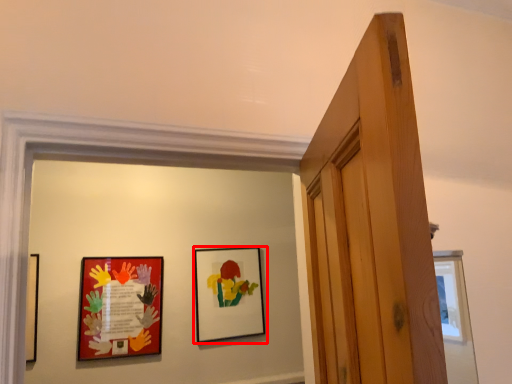
Question: From the image's perspective, where is picture frame (annotated by the red box) located in relation to picture frame in the image?

Choices:
 (A) below
 (B) above

Answer: (B)